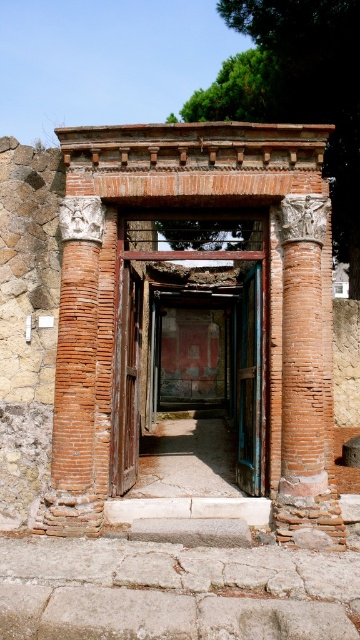
You are an archaeologist examining two doors in an ancient structure. You need to determine which door is more likely the main entrance. Considering the rustic wooden door at center and the blue painted wood door at center, which one is bigger and thus more likely the main entrance?

The rustic wooden door at center is larger in size than the blue painted wood door at center, so the rustic wooden door at center is more likely the main entrance.